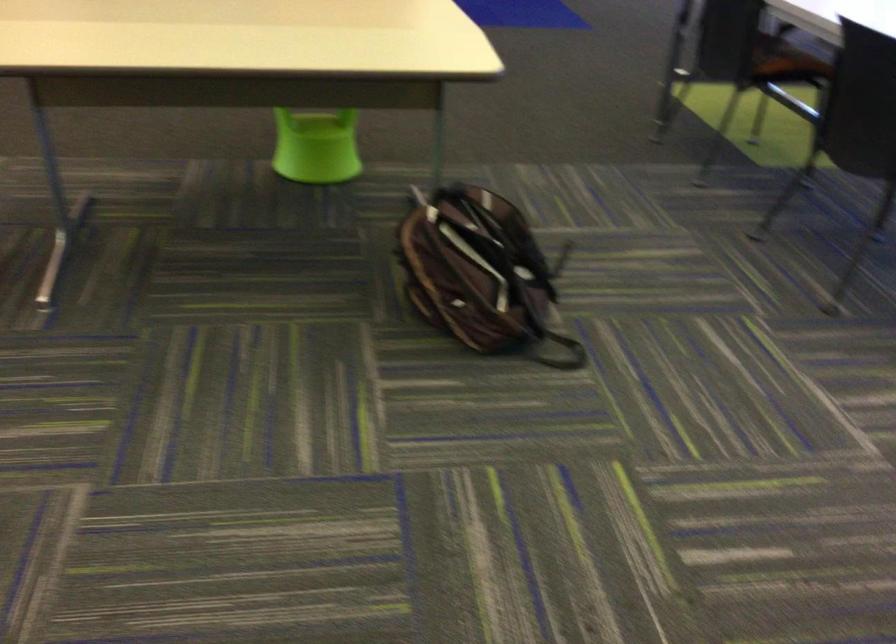
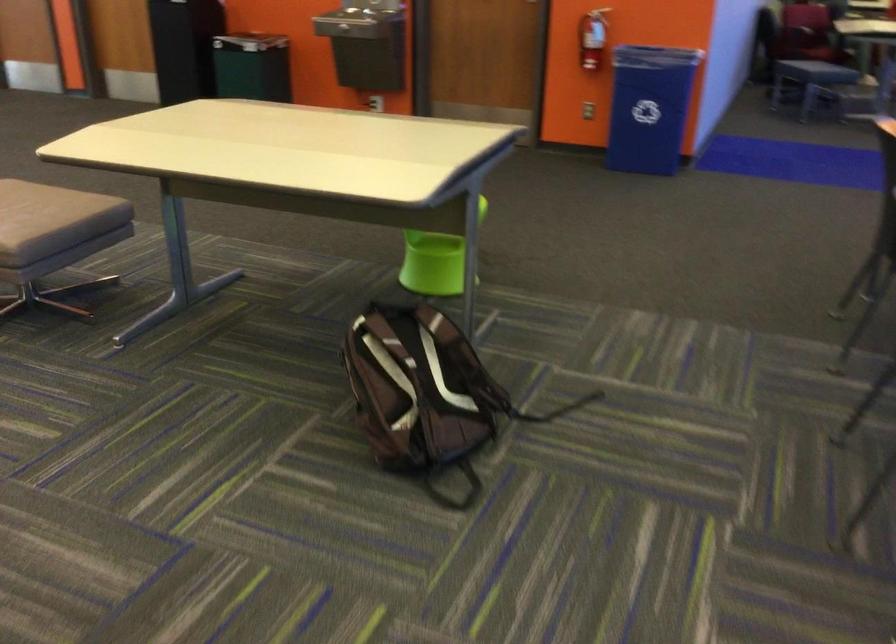
Where in the second image is the point corresponding to (328,142) from the first image?

(435, 261)